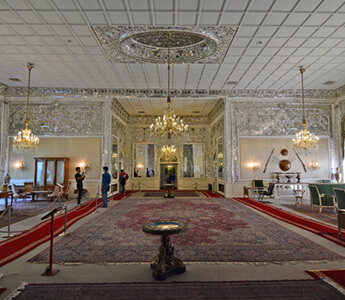
This screenshot has width=345, height=300. What are the coordinates of `white and gray tiled ceiling` in the screenshot? It's located at (268, 61).